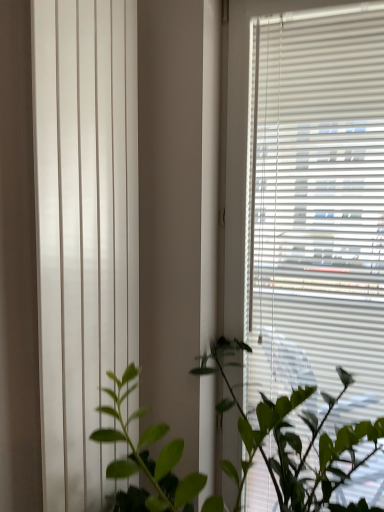
Question: Is white smooth vertical blinds at left surrounded by white matte blinds at right?

Choices:
 (A) yes
 (B) no

Answer: (B)

Question: Is white matte blinds at right outside of white smooth vertical blinds at left?

Choices:
 (A) no
 (B) yes

Answer: (B)

Question: Is white matte blinds at right at the right side of white smooth vertical blinds at left?

Choices:
 (A) yes
 (B) no

Answer: (A)

Question: Is white matte blinds at right at the left side of white smooth vertical blinds at left?

Choices:
 (A) no
 (B) yes

Answer: (A)

Question: Does white matte blinds at right lie in front of white smooth vertical blinds at left?

Choices:
 (A) yes
 (B) no

Answer: (B)

Question: From the image's perspective, is green leafy plant at center located above or below white matte blinds at right?

Choices:
 (A) below
 (B) above

Answer: (A)

Question: Is point (130, 445) positioned closer to the camera than point (367, 83)?

Choices:
 (A) closer
 (B) farther

Answer: (A)

Question: Is green leafy plant at center taller or shorter than white matte blinds at right?

Choices:
 (A) short
 (B) tall

Answer: (A)

Question: Visually, is green leafy plant at center positioned to the left or to the right of white matte blinds at right?

Choices:
 (A) right
 (B) left

Answer: (B)

Question: From the image's perspective, is green leafy plant at center positioned above or below white smooth vertical blinds at left?

Choices:
 (A) below
 (B) above

Answer: (A)

Question: From a real-world perspective, is green leafy plant at center positioned above or below white smooth vertical blinds at left?

Choices:
 (A) above
 (B) below

Answer: (B)

Question: Based on their sizes in the image, would you say green leafy plant at center is bigger or smaller than white smooth vertical blinds at left?

Choices:
 (A) big
 (B) small

Answer: (A)

Question: Based on their positions, is green leafy plant at center located to the left or right of white smooth vertical blinds at left?

Choices:
 (A) right
 (B) left

Answer: (A)

Question: Relative to white smooth vertical blinds at left, is white matte blinds at right in front or behind?

Choices:
 (A) behind
 (B) front

Answer: (A)

Question: Would you say white matte blinds at right is to the left or to the right of white smooth vertical blinds at left in the picture?

Choices:
 (A) left
 (B) right

Answer: (B)